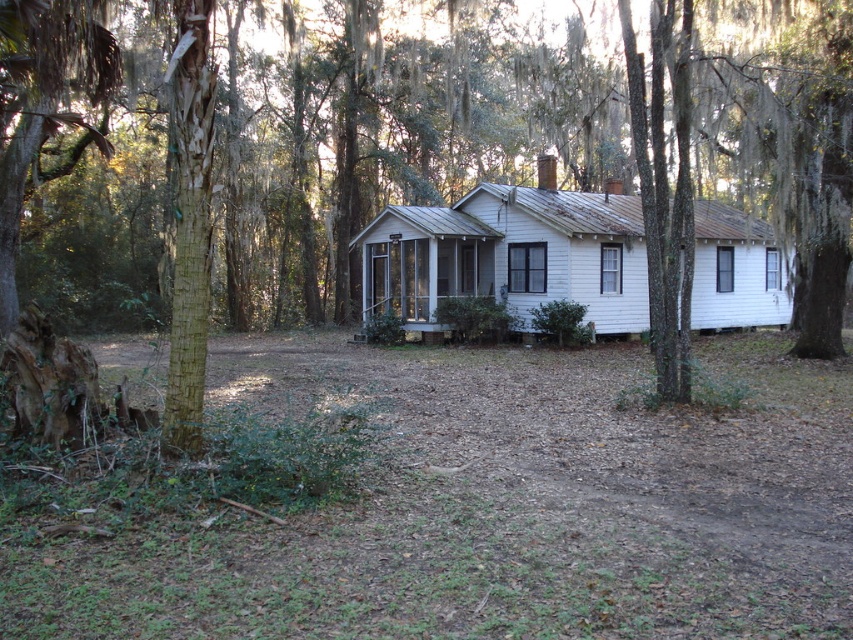
Question: Does green mossy tree at center have a larger size compared to white wood house at center?

Choices:
 (A) yes
 (B) no

Answer: (A)

Question: Is green mossy tree at center below white wood house at center?

Choices:
 (A) no
 (B) yes

Answer: (A)

Question: Among these objects, which one is nearest to the camera?

Choices:
 (A) white wood house at center
 (B) green mossy tree at center

Answer: (B)

Question: Which object appears farthest from the camera in this image?

Choices:
 (A) green mossy tree at center
 (B) white wood house at center

Answer: (B)

Question: Which point appears closest to the camera in this image?

Choices:
 (A) (631, 240)
 (B) (582, 108)

Answer: (A)

Question: Observing the image, what is the correct spatial positioning of green mossy tree at center in reference to white wood house at center?

Choices:
 (A) below
 (B) above

Answer: (B)